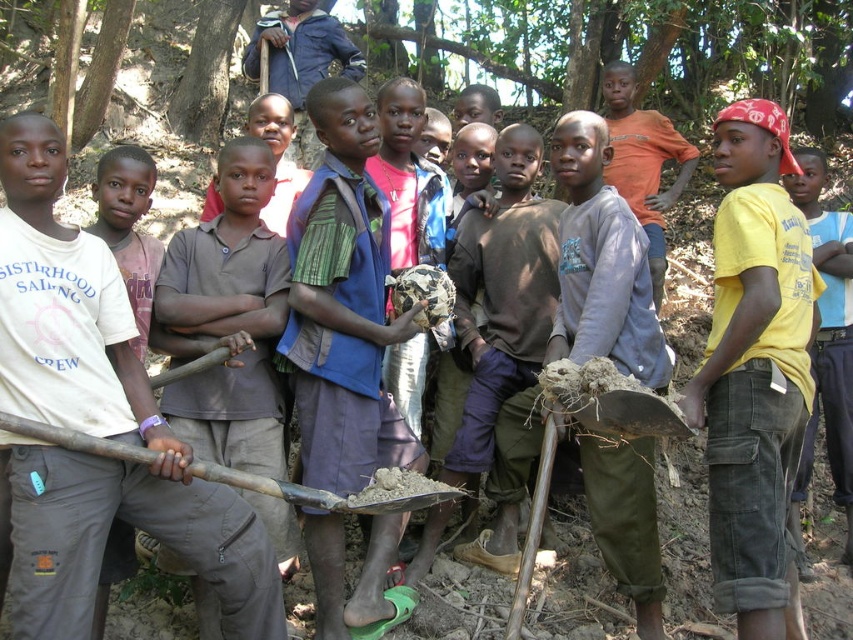
You are a photographer standing in the forest scene with the children. You want to take a photo that includes both the point at coordinates point (338, 200) and point (351, 497). Which point should be closer to the camera to ensure both are in focus?

Point (338, 200) is further to the camera than point (351, 497). To ensure both are in focus, you should focus on the point closer to the camera, which is point (351, 497).

You are standing at the point with coordinates (343, 304) in the image. What object is directly beneath your feet?

The point at coordinates (343, 304) is on the blue fabric shirt at center, so the blue fabric shirt at center is directly beneath your feet.